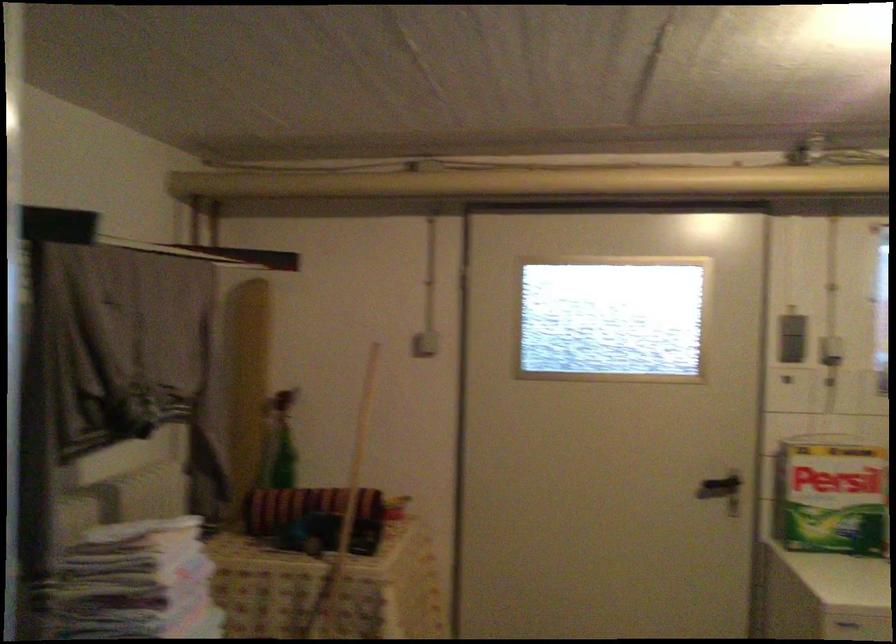
Image resolution: width=896 pixels, height=644 pixels. Find the location of `white light switch`. white light switch is located at coordinates (424, 345).